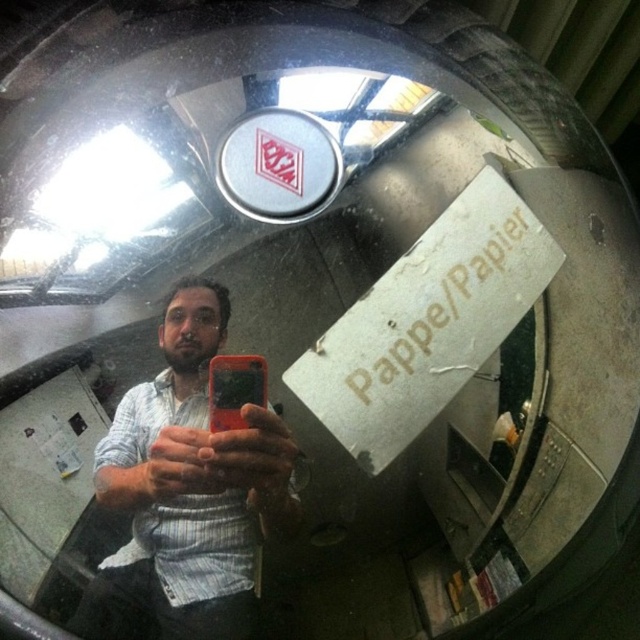
Which is more to the left, white striped shirt at center or orange matte smartphone at center?

From the viewer's perspective, white striped shirt at center appears more on the left side.

Is point (234, 561) closer to viewer compared to point (227, 397)?

No, it is behind (227, 397).

You are a GUI agent. You are given a task and a screenshot of the screen. Output one action in this format:
    pyautogui.click(x=<x>, y=<y>)
    Task: Click on the white striped shirt at center
    The image size is (640, 640).
    Given the screenshot: What is the action you would take?
    pyautogui.click(x=186, y=492)